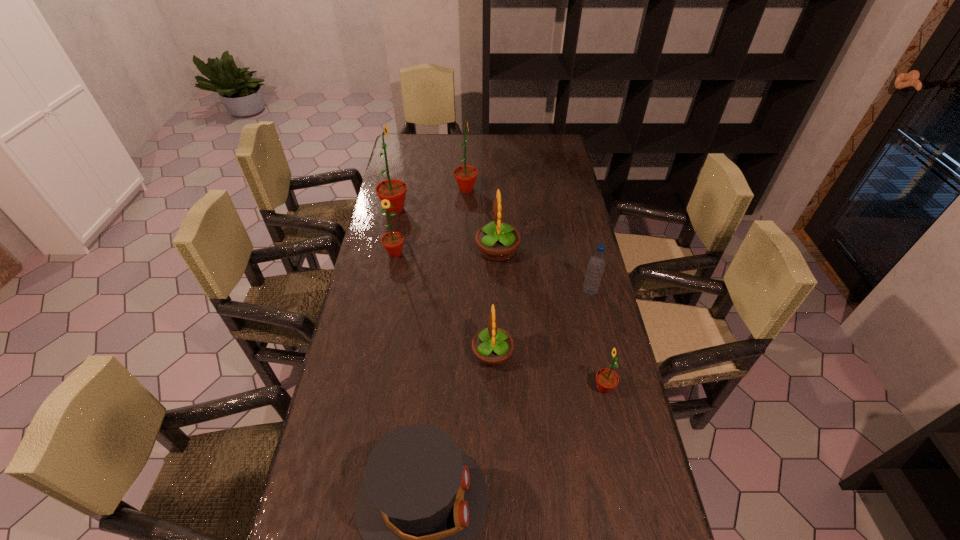
I want to click on the fourth closest green sunflower to the fifth farthest sunflower, so click(465, 175).

At what (x,y) coordinates should I click in order to perform the action: click on the closest green sunflower to the seventh farthest object. Please return your answer as a coordinate pair (x, y). The width and height of the screenshot is (960, 540). Looking at the image, I should click on (393, 242).

The image size is (960, 540). What are the coordinates of `free point that satisfies the following two spatial constraints: 1. on the front side of the water bottle; 2. on the face of the rightmost sunflower` in the screenshot? It's located at (612, 388).

The height and width of the screenshot is (540, 960). I want to click on vacant region that satisfies the following two spatial constraints: 1. on the face of the seventh nearest object; 2. on the left side of the blue water bottle, so click(376, 292).

Where is `free space that satisfies the following two spatial constraints: 1. on the face of the second tallest sunflower; 2. on the face of the third biggest green sunflower`? This screenshot has width=960, height=540. free space that satisfies the following two spatial constraints: 1. on the face of the second tallest sunflower; 2. on the face of the third biggest green sunflower is located at coordinates (464, 253).

Find the location of `vacant region that satisfies the following two spatial constraints: 1. on the face of the tallest sunflower; 2. on the back side of the blue water bottle`. vacant region that satisfies the following two spatial constraints: 1. on the face of the tallest sunflower; 2. on the back side of the blue water bottle is located at coordinates (376, 292).